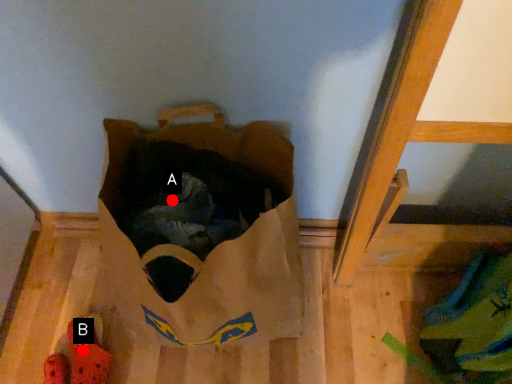
Question: Two points are circled on the image, labeled by A and B beside each circle. Among these points, which one is nearest to the camera?

Choices:
 (A) A is closer
 (B) B is closer

Answer: (A)